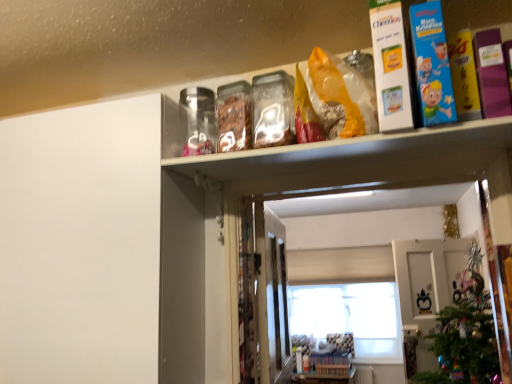
Measure the distance between blue cardboard box at upper right, the second book viewed from the right, and camera.

They are 39.19 inches apart.

This screenshot has width=512, height=384. In order to click on white matte window at center in this screenshot , I will do `click(351, 317)`.

Find the location of a particular element. blue cardboard box at upper right, acting as the 2th book starting from the left is located at coordinates (432, 64).

Which of these two, white matte window at center or clear plastic shelf at upper center, is thinner?

Thinner between the two is white matte window at center.

Is white matte window at center touching clear plastic shelf at upper center?

No, white matte window at center is not next to clear plastic shelf at upper center.

From the image's perspective, is white matte window at center beneath clear plastic shelf at upper center?

Yes, from the image's perspective, white matte window at center is beneath clear plastic shelf at upper center.

Is white matte window at center in front of clear plastic shelf at upper center?

No, it is not.

Between purple matte book at upper right, which is counted as the 1th book, starting from the right, and clear plastic shelf at upper center, which one has larger size?

With larger size is clear plastic shelf at upper center.

Is purple matte book at upper right, the 3th book when ordered from left to right, oriented away from clear plastic shelf at upper center?

That's not correct — purple matte book at upper right, the 3th book when ordered from left to right, is not looking away from clear plastic shelf at upper center.

Considering their positions, is purple matte book at upper right, the 3th book when ordered from left to right, located in front of or behind clear plastic shelf at upper center?

purple matte book at upper right, the 3th book when ordered from left to right, is behind clear plastic shelf at upper center.

Considering the positions of objects purple matte book at upper right, which is counted as the 1th book, starting from the right, and clear plastic shelf at upper center in the image provided, who is more to the left, purple matte book at upper right, which is counted as the 1th book, starting from the right, or clear plastic shelf at upper center?

Positioned to the left is clear plastic shelf at upper center.

How far apart are clear plastic shelf at upper center and blue cardboard box at upper right, acting as the 2th book starting from the left?

A distance of 18.50 inches exists between clear plastic shelf at upper center and blue cardboard box at upper right, acting as the 2th book starting from the left.

Does point (277, 42) lie behind point (418, 79)?

Yes, it is behind point (418, 79).

Is clear plastic shelf at upper center facing towards blue cardboard box at upper right, acting as the 2th book starting from the left?

No, clear plastic shelf at upper center is not facing towards blue cardboard box at upper right, acting as the 2th book starting from the left.

From a real-world perspective, which is physically below, clear plastic shelf at upper center or blue cardboard box at upper right, acting as the 2th book starting from the left?

In real-world perspective, blue cardboard box at upper right, acting as the 2th book starting from the left, is lower.

Is white matte window at center located within blue cardboard box at upper right, acting as the 2th book starting from the left?

Actually, white matte window at center is outside blue cardboard box at upper right, acting as the 2th book starting from the left.

Between blue cardboard box at upper right, the second book viewed from the right, and white matte window at center, which one has larger width?

blue cardboard box at upper right, the second book viewed from the right, is wider.

Considering the relative sizes of blue cardboard box at upper right, acting as the 2th book starting from the left, and white matte window at center in the image provided, is blue cardboard box at upper right, acting as the 2th book starting from the left, bigger than white matte window at center?

No, blue cardboard box at upper right, acting as the 2th book starting from the left, is not bigger than white matte window at center.

The height and width of the screenshot is (384, 512). Identify the location of book behind the purple matte book at upper right, which is counted as the 1th book, starting from the right. (390, 66).

Are purple matte book at upper right, the 3th book when ordered from left to right, and white cardboard box at upper right, the first book when ordered from left to right, making contact?

There is a gap between purple matte book at upper right, the 3th book when ordered from left to right, and white cardboard box at upper right, the first book when ordered from left to right.

From the image's perspective, is purple matte book at upper right, the 3th book when ordered from left to right, under white cardboard box at upper right, positioned as the 3th book in right-to-left order?

Yes, from the image's perspective, purple matte book at upper right, the 3th book when ordered from left to right, is below white cardboard box at upper right, positioned as the 3th book in right-to-left order.

How distant is purple matte book at upper right, the 3th book when ordered from left to right, from white cardboard box at upper right, the first book when ordered from left to right?

purple matte book at upper right, the 3th book when ordered from left to right, is 7.95 inches from white cardboard box at upper right, the first book when ordered from left to right.

From a real-world perspective, which object rests below the other?

green matte christmas tree at lower right, from a real-world perspective.

From the picture: From the image's perspective, who appears lower, clear plastic shelf at upper center or green matte christmas tree at lower right?

green matte christmas tree at lower right.

Is clear plastic shelf at upper center to the left of green matte christmas tree at lower right from the viewer's perspective?

Indeed, clear plastic shelf at upper center is positioned on the left side of green matte christmas tree at lower right.

Looking at this image, could you tell me if clear plastic shelf at upper center is turned towards green matte christmas tree at lower right?

No.

Between white cardboard box at upper right, the first book when ordered from left to right, and green matte christmas tree at lower right, which one is positioned in front?

white cardboard box at upper right, the first book when ordered from left to right, is closer to the camera.

Is white cardboard box at upper right, positioned as the 3th book in right-to-left order, aimed at green matte christmas tree at lower right?

No, white cardboard box at upper right, positioned as the 3th book in right-to-left order, is not oriented towards green matte christmas tree at lower right.

Which object is thinner, white cardboard box at upper right, the first book when ordered from left to right, or green matte christmas tree at lower right?

Thinner between the two is green matte christmas tree at lower right.

In the image, there is a clear plastic shelf at upper center. Where is `window below it (from the image's perspective)`? The image size is (512, 384). window below it (from the image's perspective) is located at coordinates (351, 317).

Image resolution: width=512 pixels, height=384 pixels. I want to click on shelf above the purple matte book at upper right, which is counted as the 1th book, starting from the right (from the image's perspective), so click(253, 38).

Based on the photo, when comparing their distances from purple matte book at upper right, the 3th book when ordered from left to right, does white cardboard box at upper right, the first book when ordered from left to right, or green matte christmas tree at lower right seem closer?

The object closer to purple matte book at upper right, the 3th book when ordered from left to right, is white cardboard box at upper right, the first book when ordered from left to right.

Considering their positions, is white matte window at center positioned closer to purple matte book at upper right, which is counted as the 1th book, starting from the right, than green matte christmas tree at lower right?

Based on the image, green matte christmas tree at lower right appears to be nearer to purple matte book at upper right, which is counted as the 1th book, starting from the right.

Looking at the image, which one is located closer to white cardboard box at upper right, the first book when ordered from left to right, purple matte book at upper right, which is counted as the 1th book, starting from the right, or white matte window at center?

The object closer to white cardboard box at upper right, the first book when ordered from left to right, is purple matte book at upper right, which is counted as the 1th book, starting from the right.

Which object lies further to the anchor point white cardboard box at upper right, the first book when ordered from left to right, blue cardboard box at upper right, the second book viewed from the right, or clear plastic shelf at upper center?

Among the two, clear plastic shelf at upper center is located further to white cardboard box at upper right, the first book when ordered from left to right.

Based on their spatial positions, is clear plastic shelf at upper center or green matte christmas tree at lower right closer to blue cardboard box at upper right, acting as the 2th book starting from the left?

The object closer to blue cardboard box at upper right, acting as the 2th book starting from the left, is clear plastic shelf at upper center.

Which object lies nearer to the anchor point white matte window at center, clear plastic shelf at upper center or green matte christmas tree at lower right?

Based on the image, green matte christmas tree at lower right appears to be nearer to white matte window at center.

From the image, which object appears to be farther from blue cardboard box at upper right, the second book viewed from the right, clear plastic shelf at upper center or purple matte book at upper right, the 3th book when ordered from left to right?

Among the two, clear plastic shelf at upper center is located further to blue cardboard box at upper right, the second book viewed from the right.

Based on their spatial positions, is green matte christmas tree at lower right or white matte window at center further from white cardboard box at upper right, the first book when ordered from left to right?

white matte window at center is further to white cardboard box at upper right, the first book when ordered from left to right.

This screenshot has width=512, height=384. In order to click on book between purple matte book at upper right, the 3th book when ordered from left to right, and green matte christmas tree at lower right from front to back in this screenshot , I will do `click(390, 66)`.

This screenshot has width=512, height=384. What are the coordinates of `window positioned between white cardboard box at upper right, positioned as the 3th book in right-to-left order, and green matte christmas tree at lower right from near to far` in the screenshot? It's located at (351, 317).

Image resolution: width=512 pixels, height=384 pixels. What are the coordinates of `book between white cardboard box at upper right, positioned as the 3th book in right-to-left order, and purple matte book at upper right, the 3th book when ordered from left to right` in the screenshot? It's located at (432, 64).

Locate an element on the screen. window between blue cardboard box at upper right, the second book viewed from the right, and green matte christmas tree at lower right, along the z-axis is located at coordinates (351, 317).